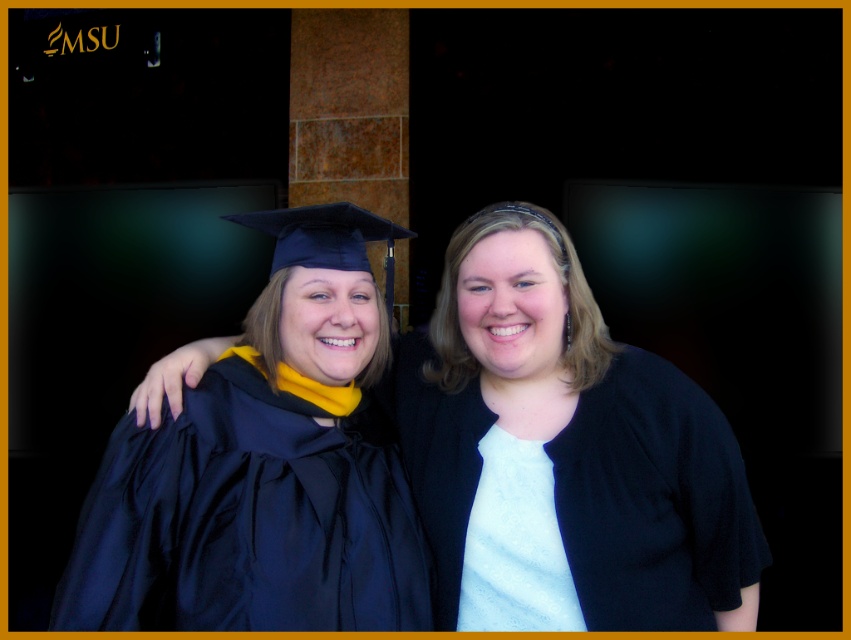
Does matte black graduation gown at center appear under matte black graduation gown at left?

Indeed, matte black graduation gown at center is positioned under matte black graduation gown at left.

Can you confirm if matte black graduation gown at center is shorter than matte black graduation gown at left?

No.

Measure the distance between matte black graduation gown at center and camera.

The distance of matte black graduation gown at center from camera is 4.85 feet.

At what (x,y) coordinates should I click in order to perform the action: click on matte black graduation gown at center. Please return your answer as a coordinate pair (x, y). Image resolution: width=851 pixels, height=640 pixels. Looking at the image, I should click on (566, 452).

Is matte black graduation gown at center closer to camera compared to white matte shirt at center?

That is False.

Is matte black graduation gown at center smaller than white matte shirt at center?

Actually, matte black graduation gown at center might be larger than white matte shirt at center.

Locate an element on the screen. This screenshot has height=640, width=851. matte black graduation gown at center is located at coordinates (566, 452).

Image resolution: width=851 pixels, height=640 pixels. Find the location of `matte black graduation gown at center`. matte black graduation gown at center is located at coordinates (566, 452).

Can you confirm if matte black graduation gown at left is positioned below white matte shirt at center?

Actually, matte black graduation gown at left is above white matte shirt at center.

Which is behind, point (300, 394) or point (677, 611)?

Positioned behind is point (300, 394).

Where is `matte black graduation gown at left`? The height and width of the screenshot is (640, 851). matte black graduation gown at left is located at coordinates (264, 468).